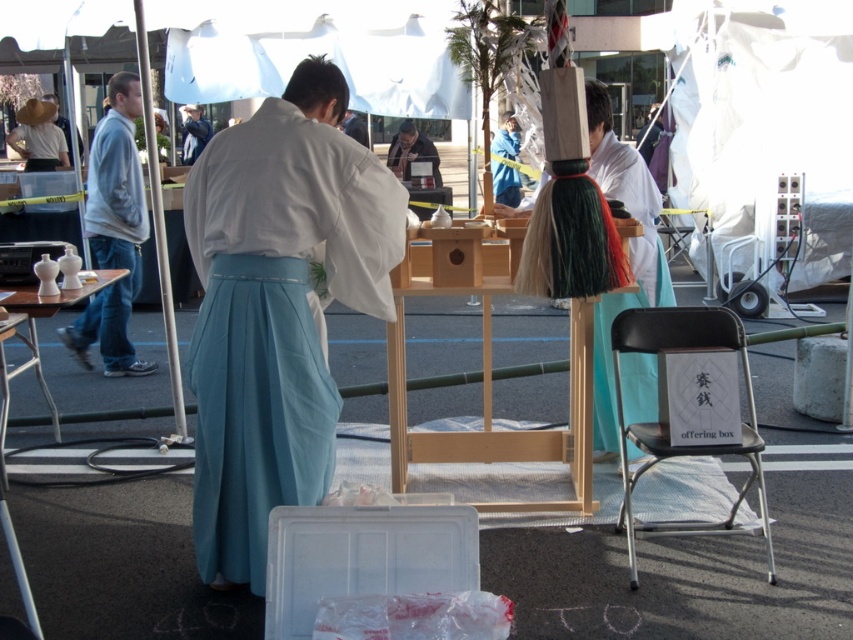
Which is above, white silk kimono at center or light blue denim jeans at left?

light blue denim jeans at left

Locate an element on the screen. white silk kimono at center is located at coordinates (628, 252).

Which of these two, light blue silk kimono at center or teal satin skirt at center, stands shorter?

With less height is teal satin skirt at center.

In the scene shown: Is light blue silk kimono at center to the right of teal satin skirt at center from the viewer's perspective?

Indeed, light blue silk kimono at center is positioned on the right side of teal satin skirt at center.

Locate an element on the screen. The image size is (853, 640). light blue silk kimono at center is located at coordinates (276, 317).

Is light blue silk kimono at center positioned behind black plastic chair at lower right?

No.

Locate an element on the screen. The height and width of the screenshot is (640, 853). light blue silk kimono at center is located at coordinates (276, 317).

Describe the element at coordinates (276, 317) in the screenshot. I see `light blue silk kimono at center` at that location.

This screenshot has width=853, height=640. I want to click on light blue silk kimono at center, so click(276, 317).